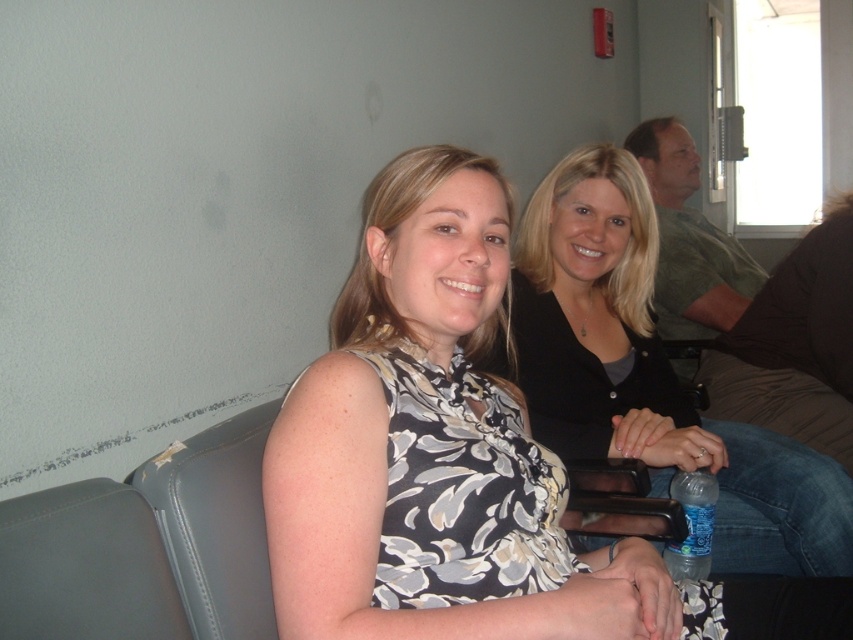
Question: Is floral print blouse at center closer to camera compared to blue plastic bottle at lower right?

Choices:
 (A) yes
 (B) no

Answer: (A)

Question: Based on their relative distances, which object is farther from the gray leather chair at lower left?

Choices:
 (A) floral print blouse at center
 (B) blue plastic bottle at lower right

Answer: (B)

Question: Which object appears farthest from the camera in this image?

Choices:
 (A) floral print blouse at center
 (B) blue plastic bottle at lower right

Answer: (B)

Question: Is floral print blouse at center above gray leather chair at lower left?

Choices:
 (A) yes
 (B) no

Answer: (A)

Question: Is floral print blouse at center smaller than gray leather chair at lower left?

Choices:
 (A) yes
 (B) no

Answer: (B)

Question: Which point is farther to the camera?

Choices:
 (A) floral print blouse at center
 (B) gray leather chair at lower left
 (C) blue plastic bottle at lower right

Answer: (C)